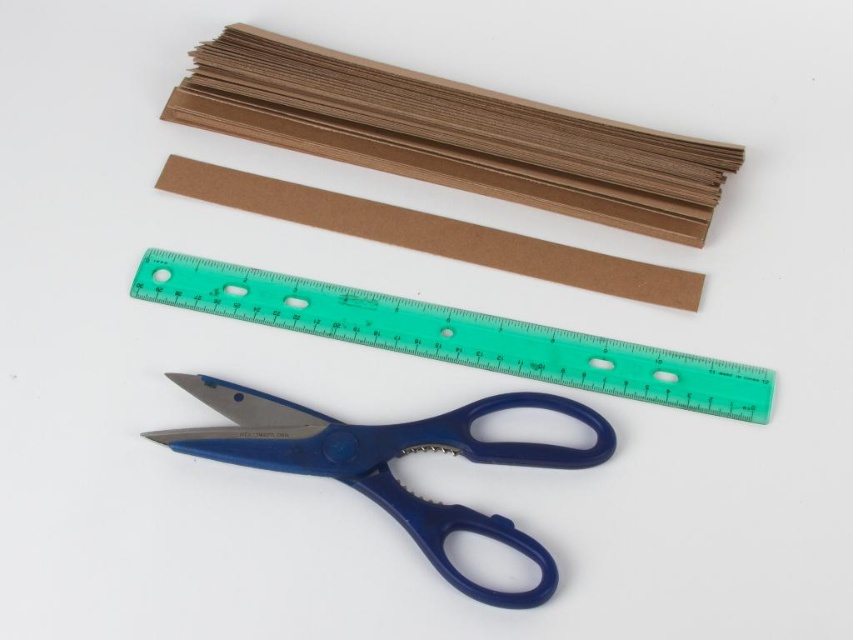
You are organizing a crafting kit and need to place the brown corrugated cardboard at upper center and the blue plastic scissors at lower center into a storage box. The box has a height limit of 15 cm. Can you fit both items vertically without bending or damaging them?

The brown corrugated cardboard at upper center is bigger than the blue plastic scissors at lower center. However, the height requirement of 15 cm is not specified for either item, so it is uncertain if they will fit vertically without further information about their dimensions.

You are standing in front of a crafting setup and want to pick up the brown corrugated cardboard at upper center. If your hand can reach up to 1.35 meters, can you comfortably reach it?

The brown corrugated cardboard at upper center is 1.40 meters away from the viewer, which is slightly beyond your hand reach of 1.35 meters. You might need to stretch or adjust your position to reach it.